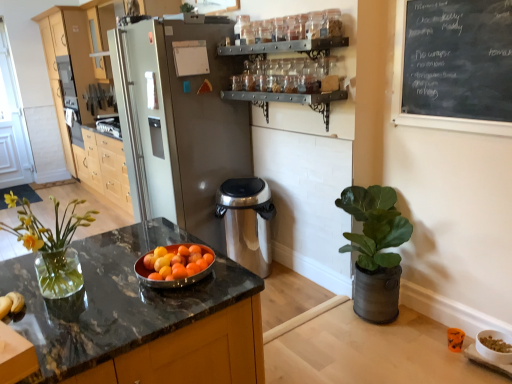
Locate an element on the screen. The image size is (512, 384). vacant region in front of clear glass vase at left is located at coordinates (68, 328).